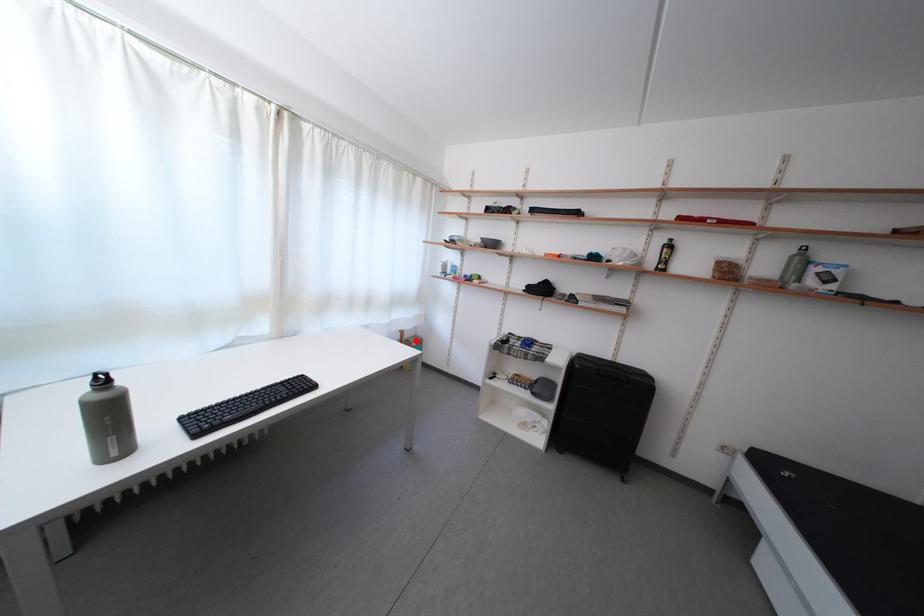
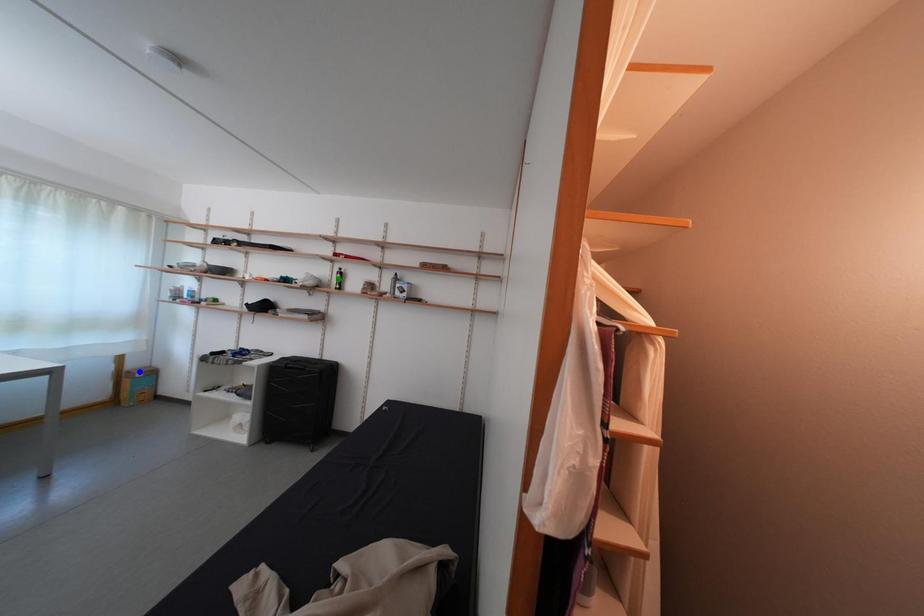
Question: I am providing you with two images of the same scene from different viewpoints. A red point is marked on the first image. You are given multiple points on the second image. Which mark in image 2 goes with the point in image 1?

Choices:
 (A) blue point
 (B) yellow point
 (C) green point

Answer: (A)